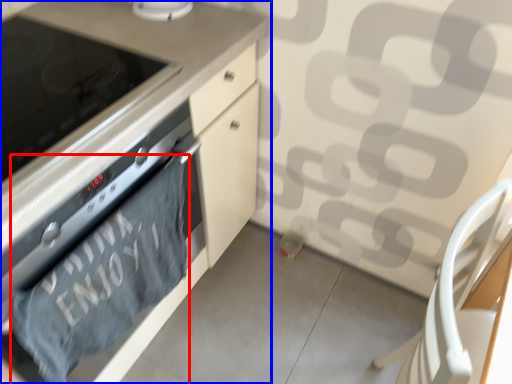
Question: Which of the following is the closest to the observer, bath towel (highlighted by a red box) or cabinetry (highlighted by a blue box)?

Choices:
 (A) bath towel
 (B) cabinetry

Answer: (B)